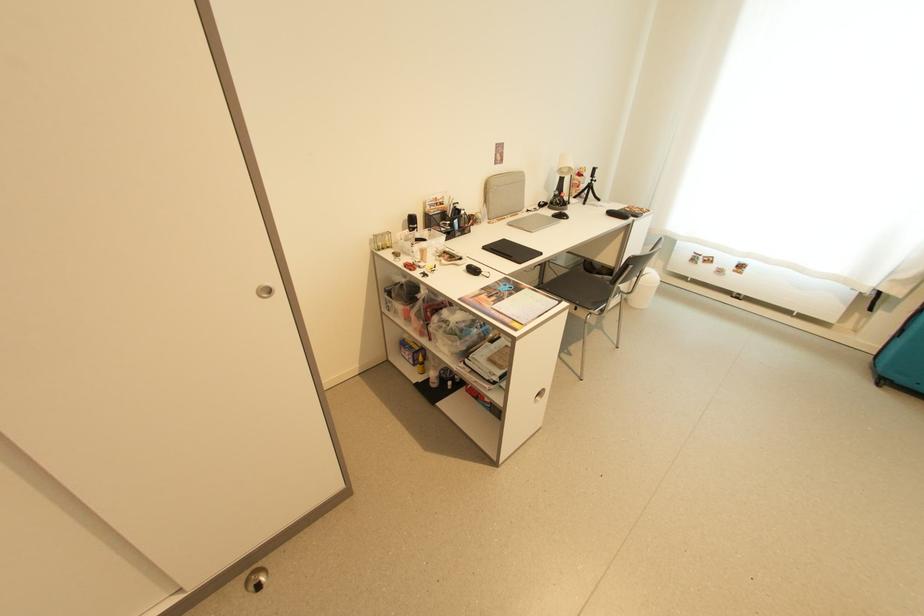
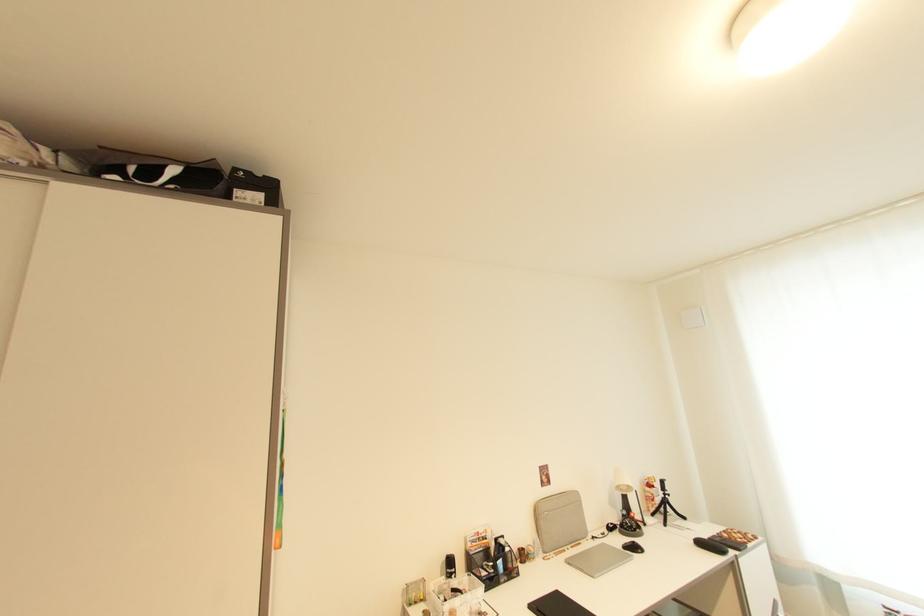
In the second image, find the point that corresponds to (594,184) in the first image.

(669, 498)